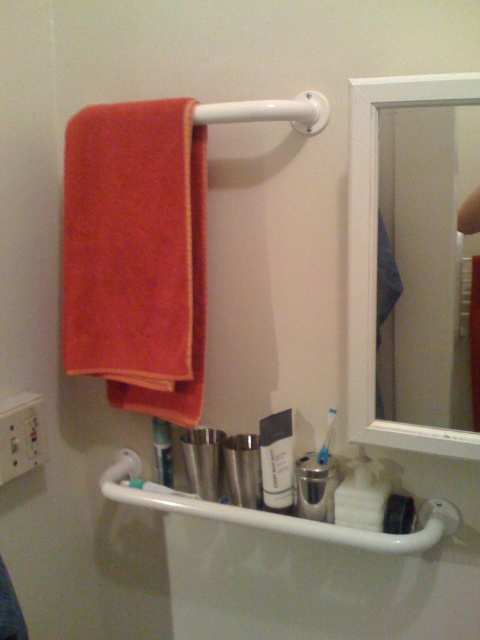
Question: Does white framed mirror at upper right have a greater width compared to white glossy lotion at center?

Choices:
 (A) no
 (B) yes

Answer: (B)

Question: Where is white framed mirror at upper right located in relation to white glossy lotion at center in the image?

Choices:
 (A) right
 (B) left

Answer: (A)

Question: Does white framed mirror at upper right lie in front of white plastic towel bar at upper center?

Choices:
 (A) yes
 (B) no

Answer: (A)

Question: Which is farther from the orange terry cloth towel at left?

Choices:
 (A) white plastic towel bar at upper center
 (B) white glossy lotion at center
 (C) white glossy toothpaste at lower center
 (D) white plastic toothbrush at lower center

Answer: (D)

Question: Which of the following is the closest to the observer?

Choices:
 (A) orange terry cloth towel at left
 (B) white glossy toothpaste at lower center
 (C) brushed metal toothbrush at lower center
 (D) white glossy lotion at center

Answer: (A)

Question: Which point is farther to the camera?

Choices:
 (A) white framed mirror at upper right
 (B) white plastic toothbrush at lower center
 (C) white glossy toothpaste at lower center

Answer: (C)